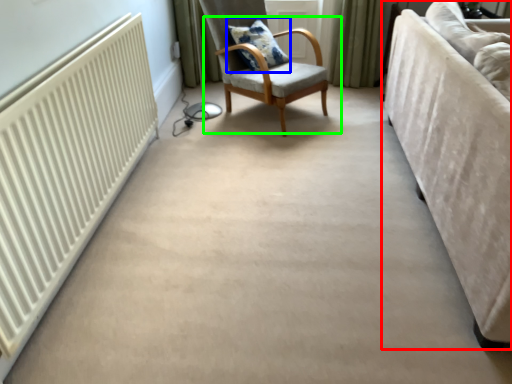
Question: Which object is positioned closest to studio couch (highlighted by a red box)? Select from pillow (highlighted by a blue box) and chair (highlighted by a green box).

Choices:
 (A) pillow
 (B) chair

Answer: (B)